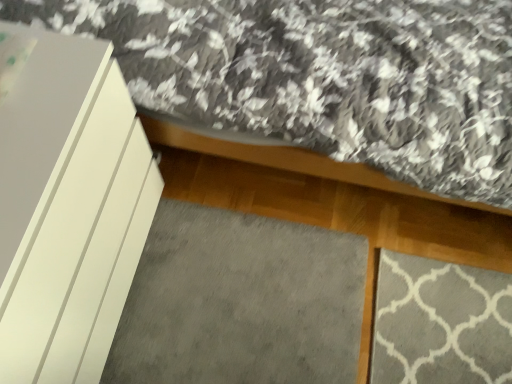
Question: Is point (169, 370) closer or farther from the camera than point (31, 263)?

Choices:
 (A) farther
 (B) closer

Answer: (A)

Question: From the image's perspective, is gray soft carpet at lower center located above or below white matte cabinet at left?

Choices:
 (A) above
 (B) below

Answer: (B)

Question: Considering the positions of gray soft carpet at lower center and white matte cabinet at left in the image, is gray soft carpet at lower center taller or shorter than white matte cabinet at left?

Choices:
 (A) short
 (B) tall

Answer: (A)

Question: Is white matte cabinet at left taller or shorter than gray soft carpet at lower center?

Choices:
 (A) short
 (B) tall

Answer: (B)

Question: In terms of size, does white matte cabinet at left appear bigger or smaller than gray soft carpet at lower center?

Choices:
 (A) small
 (B) big

Answer: (B)

Question: Would you say white matte cabinet at left is inside or outside gray soft carpet at lower center?

Choices:
 (A) inside
 (B) outside

Answer: (B)

Question: Would you say white matte cabinet at left is to the left or to the right of gray soft carpet at lower center in the picture?

Choices:
 (A) right
 (B) left

Answer: (B)